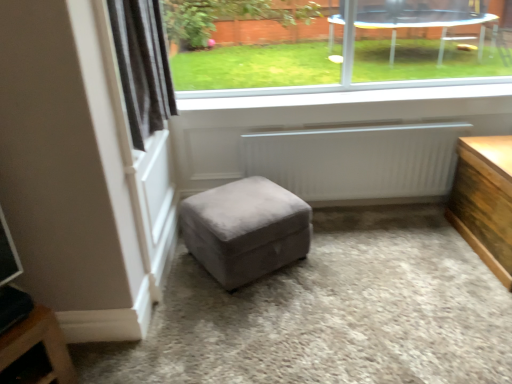
The height and width of the screenshot is (384, 512). Describe the element at coordinates (246, 229) in the screenshot. I see `suede gray ottoman at center` at that location.

What do you see at coordinates (142, 66) in the screenshot?
I see `black velvet curtain at upper left` at bounding box center [142, 66].

Image resolution: width=512 pixels, height=384 pixels. What do you see at coordinates (485, 201) in the screenshot?
I see `wooden table at right` at bounding box center [485, 201].

I want to click on wooden table at right, so click(x=485, y=201).

The height and width of the screenshot is (384, 512). Identify the location of white matte radiator at center. (358, 161).

Does transparent glass window at upper center touch black velvet curtain at upper left?

No, transparent glass window at upper center is not touching black velvet curtain at upper left.

From a real-world perspective, which object stands above the other?

black velvet curtain at upper left, from a real-world perspective.

Is transparent glass window at upper center completely or partially outside of black velvet curtain at upper left?

transparent glass window at upper center lies outside black velvet curtain at upper left's area.

Is white matte radiator at center oriented away from white smooth window sill at upper center?

No, white matte radiator at center's orientation is not away from white smooth window sill at upper center.

Based on the photo, between white matte radiator at center and white smooth window sill at upper center, which one has larger size?

Bigger between the two is white matte radiator at center.

From a real-world perspective, does white matte radiator at center sit lower than white smooth window sill at upper center?

Yes, from a real-world perspective, white matte radiator at center is under white smooth window sill at upper center.

From the image's perspective, is white matte radiator at center under white smooth window sill at upper center?

Yes, from the image's perspective, white matte radiator at center is below white smooth window sill at upper center.

From the image's perspective, is suede gray ottoman at center under white smooth window sill at upper center?

Yes, from the image's perspective, suede gray ottoman at center is beneath white smooth window sill at upper center.

Which of these two, suede gray ottoman at center or white smooth window sill at upper center, is thinner?

With smaller width is white smooth window sill at upper center.

Where is `stool that is on the left side of white smooth window sill at upper center`? stool that is on the left side of white smooth window sill at upper center is located at coordinates (246, 229).

Can we say transparent glass window at upper center lies outside suede gray ottoman at center?

Indeed, transparent glass window at upper center is completely outside suede gray ottoman at center.

Is transparent glass window at upper center in front of or behind suede gray ottoman at center in the image?

Clearly, transparent glass window at upper center is behind suede gray ottoman at center.

Between transparent glass window at upper center and suede gray ottoman at center, which one has smaller width?

With smaller width is transparent glass window at upper center.

Would you consider transparent glass window at upper center to be distant from suede gray ottoman at center?

That's right, there is a large distance between transparent glass window at upper center and suede gray ottoman at center.

Is wooden table at right in front of transparent glass window at upper center?

Yes, wooden table at right is closer to the viewer.

Is wooden table at right turned away from transparent glass window at upper center?

That's not correct — wooden table at right is not looking away from transparent glass window at upper center.

From a real-world perspective, who is located higher, wooden table at right or transparent glass window at upper center?

In real-world perspective, transparent glass window at upper center is above.

Are wooden table at right and transparent glass window at upper center far apart?

That's right, there is a large distance between wooden table at right and transparent glass window at upper center.

How different are the orientations of white matte radiator at center and black velvet curtain at upper left in degrees?

The angle between the facing direction of white matte radiator at center and the facing direction of black velvet curtain at upper left is 89.3 degrees.

From the picture: Which of these two, white matte radiator at center or black velvet curtain at upper left, stands taller?

black velvet curtain at upper left.

How much distance is there between white matte radiator at center and black velvet curtain at upper left?

A distance of 3.79 feet exists between white matte radiator at center and black velvet curtain at upper left.

Is white matte radiator at center in contact with black velvet curtain at upper left?

No, white matte radiator at center is not next to black velvet curtain at upper left.

Is black velvet curtain at upper left bigger or smaller than white smooth window sill at upper center?

Clearly, black velvet curtain at upper left is larger in size than white smooth window sill at upper center.

How many degrees apart are the facing directions of black velvet curtain at upper left and white smooth window sill at upper center?

They differ by 89.2 degrees in their facing directions.

Between point (161, 107) and point (226, 91), which one is positioned in front?

The point (161, 107) is more forward.

In the scene shown: Which object is positioned more to the left, black velvet curtain at upper left or white smooth window sill at upper center?

black velvet curtain at upper left is more to the left.

The height and width of the screenshot is (384, 512). There is a transparent glass window at upper center. In order to click on curtain above it (from a real-world perspective) in this screenshot , I will do `click(142, 66)`.

In the image, there is a white matte radiator at center. Identify the location of window sill above it (from the image's perspective). (344, 93).

Which object lies nearer to the anchor point suede gray ottoman at center, white matte radiator at center or black velvet curtain at upper left?

Among the two, white matte radiator at center is located nearer to suede gray ottoman at center.

Based on their spatial positions, is transparent glass window at upper center or white smooth window sill at upper center closer to wooden table at right?

The object closer to wooden table at right is white smooth window sill at upper center.

Which object lies further to the anchor point suede gray ottoman at center, wooden table at right or transparent glass window at upper center?

The object further to suede gray ottoman at center is transparent glass window at upper center.

From the image, which object appears to be farther from transparent glass window at upper center, suede gray ottoman at center or white matte radiator at center?

suede gray ottoman at center is positioned further to the anchor transparent glass window at upper center.

Considering their positions, is transparent glass window at upper center positioned closer to white matte radiator at center than suede gray ottoman at center?

suede gray ottoman at center lies closer to white matte radiator at center than the other object.

Estimate the real-world distances between objects in this image. Which object is further from white smooth window sill at upper center, wooden table at right or white matte radiator at center?

Among the two, wooden table at right is located further to white smooth window sill at upper center.

Which object lies nearer to the anchor point wooden table at right, black velvet curtain at upper left or transparent glass window at upper center?

Based on the image, transparent glass window at upper center appears to be nearer to wooden table at right.

Looking at the image, which one is located further to wooden table at right, suede gray ottoman at center or black velvet curtain at upper left?

The object further to wooden table at right is black velvet curtain at upper left.

This screenshot has height=384, width=512. Find the location of `radiator that lies between white smooth window sill at upper center and suede gray ottoman at center from top to bottom`. radiator that lies between white smooth window sill at upper center and suede gray ottoman at center from top to bottom is located at coordinates (358, 161).

Find the location of `window sill between transparent glass window at upper center and suede gray ottoman at center from top to bottom`. window sill between transparent glass window at upper center and suede gray ottoman at center from top to bottom is located at coordinates pyautogui.click(x=344, y=93).

Where is `curtain between transparent glass window at upper center and suede gray ottoman at center in the up-down direction`? curtain between transparent glass window at upper center and suede gray ottoman at center in the up-down direction is located at coordinates (142, 66).

At what (x,y) coordinates should I click in order to perform the action: click on window sill between transparent glass window at upper center and white matte radiator at center vertically. Please return your answer as a coordinate pair (x, y). This screenshot has height=384, width=512. Looking at the image, I should click on (344, 93).